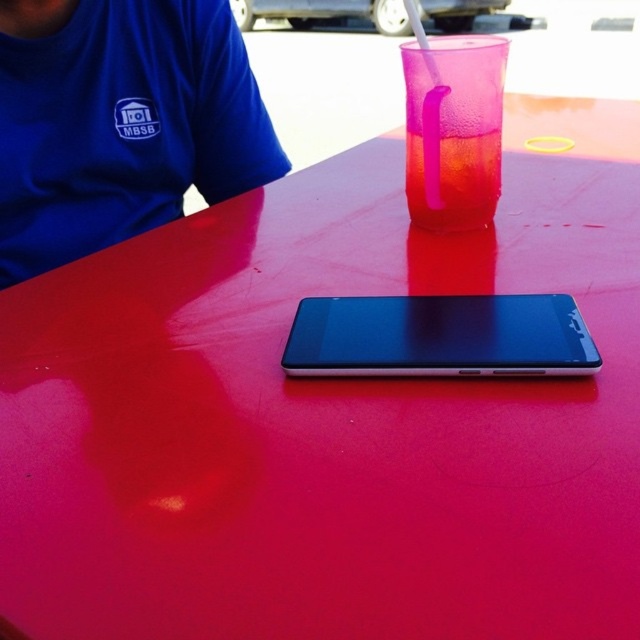
From the picture: Can you confirm if translucent pink liquid at center is wider than translucent plastic straw at upper center?

Indeed, translucent pink liquid at center has a greater width compared to translucent plastic straw at upper center.

Is point (499, 188) positioned in front of point (440, 99)?

No.

Locate an element on the screen. translucent pink liquid at center is located at coordinates (451, 179).

Is sleek black phone at center bigger than translucent plastic straw at upper center?

No, sleek black phone at center is not bigger than translucent plastic straw at upper center.

Is point (424, 301) less distant than point (436, 192)?

Yes, point (424, 301) is closer to viewer.

Locate an element on the screen. This screenshot has width=640, height=640. sleek black phone at center is located at coordinates (440, 337).

Is blue fabric shirt at upper left to the right of translucent pink liquid at center from the viewer's perspective?

Incorrect, blue fabric shirt at upper left is not on the right side of translucent pink liquid at center.

Can you confirm if blue fabric shirt at upper left is taller than translucent pink liquid at center?

Correct, blue fabric shirt at upper left is much taller as translucent pink liquid at center.

The height and width of the screenshot is (640, 640). What do you see at coordinates (120, 122) in the screenshot?
I see `blue fabric shirt at upper left` at bounding box center [120, 122].

Where is `blue fabric shirt at upper left`? blue fabric shirt at upper left is located at coordinates (120, 122).